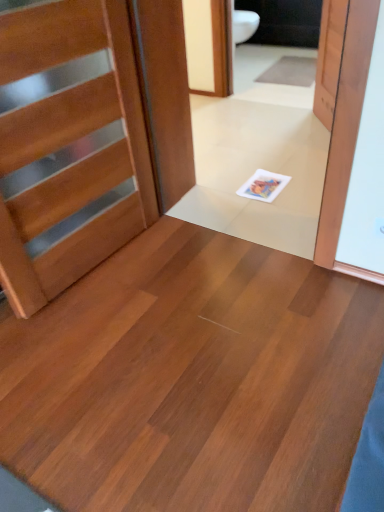
The image size is (384, 512). What do you see at coordinates (68, 146) in the screenshot?
I see `wooden door at left, which is counted as the 2th door, starting from the right` at bounding box center [68, 146].

Image resolution: width=384 pixels, height=512 pixels. Describe the element at coordinates (290, 72) in the screenshot. I see `gray carpet at upper center` at that location.

Identify the location of matte wood floor at center. The image size is (384, 512). (192, 379).

Locate an element on the screen. Image resolution: width=384 pixels, height=512 pixels. door above the wooden door at upper right, placed as the 1th door when sorted from back to front (from a real-world perspective) is located at coordinates (68, 146).

Is wooden door at upper right, the 2th door when ordered from left to right, at the back of wooden door at left, placed as the first door when sorted from front to back?

No, wooden door at left, placed as the first door when sorted from front to back,'s orientation is not away from wooden door at upper right, the 2th door when ordered from left to right.

From a real-world perspective, who is located higher, wooden door at left, which is counted as the 2th door, starting from the right, or wooden door at upper right, the 2th door when ordered from left to right?

wooden door at left, which is counted as the 2th door, starting from the right, is physically above.

Is wooden door at upper right, marked as the second door in a front-to-back arrangement, in front of or behind wooden door at left, marked as the 1th door in a left-to-right arrangement, in the image?

Visually, wooden door at upper right, marked as the second door in a front-to-back arrangement, is located behind wooden door at left, marked as the 1th door in a left-to-right arrangement.

Considering the points (343, 12) and (52, 164), which point is behind, point (343, 12) or point (52, 164)?

The point (343, 12) is more distant.

You are a GUI agent. You are given a task and a screenshot of the screen. Output one action in this format:
    pyautogui.click(x=<x>, y=<y>)
    Task: Click on the door located above the wooden door at left, which is counted as the 2th door, starting from the right (from the image's perspective)
    The height and width of the screenshot is (512, 384).
    Given the screenshot: What is the action you would take?
    pyautogui.click(x=329, y=59)

Is matte wood floor at center wider than gray carpet at upper center?

Correct, the width of matte wood floor at center exceeds that of gray carpet at upper center.

Is matte wood floor at center positioned with its back to gray carpet at upper center?

No, gray carpet at upper center is not at the back of matte wood floor at center.

Between matte wood floor at center and gray carpet at upper center, which one appears on the left side from the viewer's perspective?

From the viewer's perspective, matte wood floor at center appears more on the left side.

From the image's perspective, between gray carpet at upper center and wooden door at left, placed as the first door when sorted from front to back, which one is located above?

gray carpet at upper center appears higher in the image.

Is point (259, 82) farther from viewer compared to point (0, 35)?

Yes, point (259, 82) is farther from viewer.

Is gray carpet at upper center bigger than wooden door at left, marked as the 1th door in a left-to-right arrangement?

Incorrect, gray carpet at upper center is not larger than wooden door at left, marked as the 1th door in a left-to-right arrangement.

Are gray carpet at upper center and wooden door at left, placed as the first door when sorted from front to back, making contact?

There is a gap between gray carpet at upper center and wooden door at left, placed as the first door when sorted from front to back.

You are a GUI agent. You are given a task and a screenshot of the screen. Output one action in this format:
    pyautogui.click(x=<x>, y=<y>)
    Task: Click on the plywood on the right of wooden door at left, placed as the first door when sorted from front to back
    
    Given the screenshot: What is the action you would take?
    point(192,379)

Is wooden door at left, marked as the 1th door in a left-to-right arrangement, situated inside matte wood floor at center or outside?

wooden door at left, marked as the 1th door in a left-to-right arrangement, is not enclosed by matte wood floor at center.

In the image, is wooden door at left, marked as the 1th door in a left-to-right arrangement, on the left side or the right side of matte wood floor at center?

Clearly, wooden door at left, marked as the 1th door in a left-to-right arrangement, is on the left of matte wood floor at center in the image.

Consider the image. From the image's perspective, is wooden door at left, marked as the 1th door in a left-to-right arrangement, located above or below matte wood floor at center?

wooden door at left, marked as the 1th door in a left-to-right arrangement, is above matte wood floor at center.

Considering the positions of objects wooden door at left, which is counted as the 2th door, starting from the right, and gray carpet at upper center in the image provided, who is more to the right, wooden door at left, which is counted as the 2th door, starting from the right, or gray carpet at upper center?

Positioned to the right is gray carpet at upper center.

Can you tell me how much wooden door at left, marked as the second door in a back-to-front arrangement, and gray carpet at upper center differ in facing direction?

The angle between the facing direction of wooden door at left, marked as the second door in a back-to-front arrangement, and the facing direction of gray carpet at upper center is 81.1 degrees.

Is wooden door at left, which is counted as the 2th door, starting from the right, facing towards gray carpet at upper center?

No, wooden door at left, which is counted as the 2th door, starting from the right, is not aimed at gray carpet at upper center.

From the image's perspective, is wooden door at left, marked as the second door in a back-to-front arrangement, above gray carpet at upper center?

No, from the image's perspective, wooden door at left, marked as the second door in a back-to-front arrangement, is not over gray carpet at upper center.

From the image's perspective, would you say wooden door at upper right, marked as the second door in a front-to-back arrangement, is positioned over gray carpet at upper center?

No, from the image's perspective, wooden door at upper right, marked as the second door in a front-to-back arrangement, is not over gray carpet at upper center.

Looking at this image, is wooden door at upper right, placed as the 1th door when sorted from back to front, positioned in front of gray carpet at upper center?

Yes, it is.

Is gray carpet at upper center located within wooden door at upper right, placed as the 1th door when sorted from back to front?

No, gray carpet at upper center is not surrounded by wooden door at upper right, placed as the 1th door when sorted from back to front.

Considering the sizes of wooden door at upper right, placed as the 1th door when sorted from back to front, and gray carpet at upper center in the image, is wooden door at upper right, placed as the 1th door when sorted from back to front, wider or thinner than gray carpet at upper center?

Considering their sizes, wooden door at upper right, placed as the 1th door when sorted from back to front, looks slimmer than gray carpet at upper center.

Identify the location of door on the right side of wooden door at left, which is counted as the 2th door, starting from the right. The width and height of the screenshot is (384, 512). (329, 59).

This screenshot has height=512, width=384. In order to click on door that appears below the wooden door at left, placed as the first door when sorted from front to back (from a real-world perspective) in this screenshot , I will do `click(329, 59)`.

Looking at this image, estimate the real-world distances between objects in this image. Which object is further from gray carpet at upper center, wooden door at left, placed as the first door when sorted from front to back, or matte wood floor at center?

matte wood floor at center is positioned further to the anchor gray carpet at upper center.

From the image, which object appears to be nearer to wooden door at left, which is counted as the 2th door, starting from the right, wooden door at upper right, which is the 1th door in right-to-left order, or matte wood floor at center?

Among the two, matte wood floor at center is located nearer to wooden door at left, which is counted as the 2th door, starting from the right.

Based on their spatial positions, is gray carpet at upper center or wooden door at left, marked as the second door in a back-to-front arrangement, further from matte wood floor at center?

gray carpet at upper center is further to matte wood floor at center.

Looking at the image, which one is located closer to gray carpet at upper center, matte wood floor at center or wooden door at upper right, the 2th door when ordered from left to right?

wooden door at upper right, the 2th door when ordered from left to right, is positioned closer to the anchor gray carpet at upper center.

Looking at this image, considering their positions, is wooden door at upper right, placed as the 1th door when sorted from back to front, positioned closer to gray carpet at upper center than matte wood floor at center?

The object closer to gray carpet at upper center is wooden door at upper right, placed as the 1th door when sorted from back to front.

When comparing their distances from matte wood floor at center, does wooden door at upper right, which is the 1th door in right-to-left order, or wooden door at left, marked as the second door in a back-to-front arrangement, seem closer?

wooden door at left, marked as the second door in a back-to-front arrangement, is closer to matte wood floor at center.

Considering their positions, is matte wood floor at center positioned further to wooden door at upper right, the 2th door when ordered from left to right, than gray carpet at upper center?

Among the two, matte wood floor at center is located further to wooden door at upper right, the 2th door when ordered from left to right.

Consider the image. When comparing their distances from wooden door at upper right, which is the 1th door in right-to-left order, does gray carpet at upper center or matte wood floor at center seem further?

matte wood floor at center is positioned further to the anchor wooden door at upper right, which is the 1th door in right-to-left order.

At what (x,y) coordinates should I click in order to perform the action: click on door between wooden door at upper right, the 2th door when ordered from left to right, and matte wood floor at center vertically. Please return your answer as a coordinate pair (x, y). The width and height of the screenshot is (384, 512). Looking at the image, I should click on (68, 146).

The width and height of the screenshot is (384, 512). I want to click on door between wooden door at left, which is counted as the 2th door, starting from the right, and gray carpet at upper center from front to back, so click(329, 59).